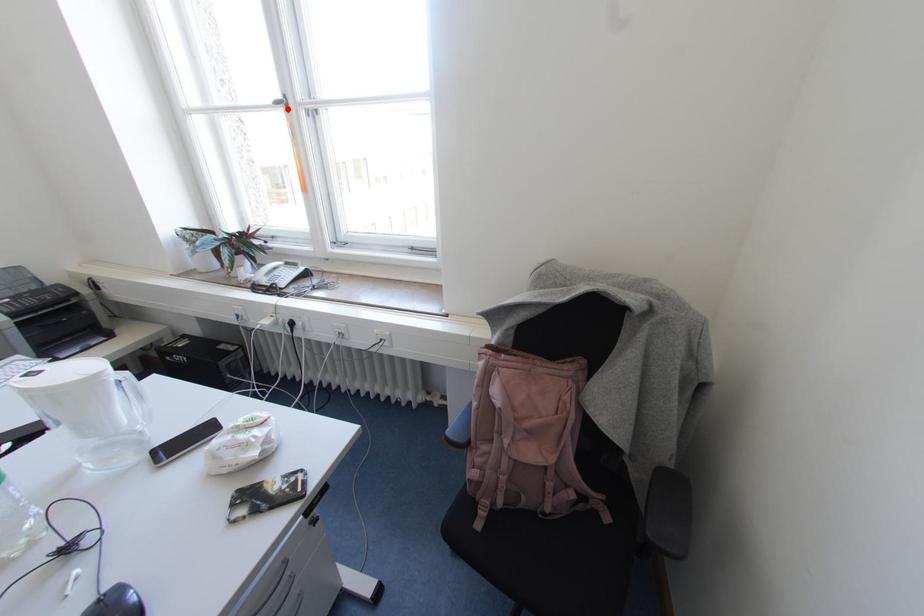
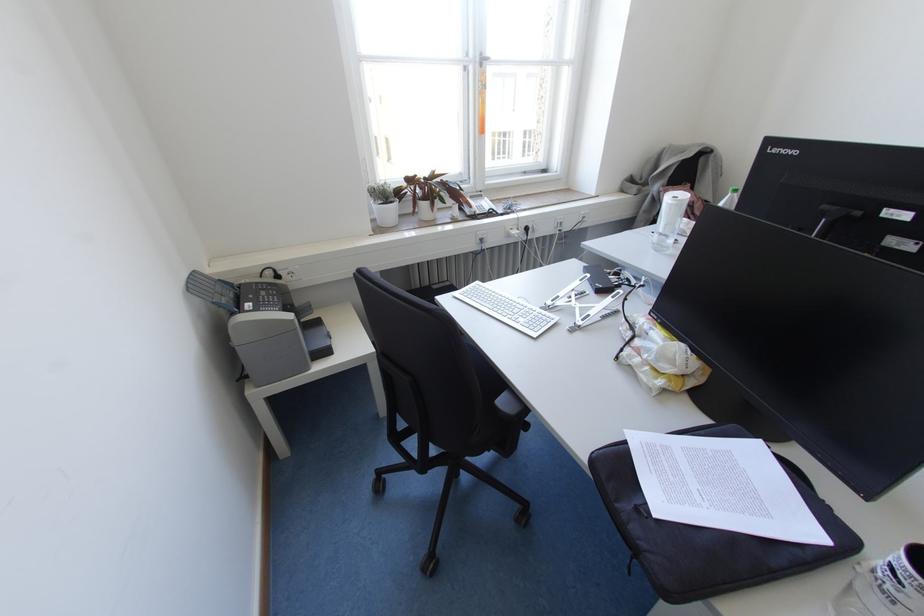
The point at the highlighted location is marked in the first image. Where is the corresponding point in the second image?

(480, 65)